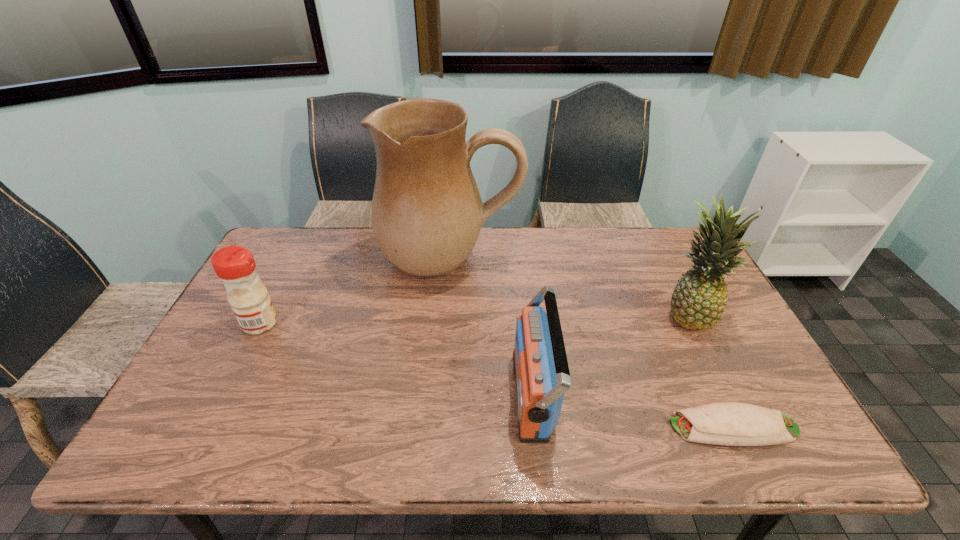
The width and height of the screenshot is (960, 540). I want to click on free space between the pineapple and the tallest object, so click(570, 287).

Identify the location of vacant area that lies between the radio receiver and the leftmost object. Image resolution: width=960 pixels, height=540 pixels. (396, 359).

This screenshot has width=960, height=540. I want to click on free space between the farthest object and the burrito, so click(592, 343).

Where is `free space between the leftmost object and the farthest object`? free space between the leftmost object and the farthest object is located at coordinates (355, 291).

The image size is (960, 540). I want to click on vacant space that is in between the fourth shortest object and the cream pitcher, so point(570,287).

Image resolution: width=960 pixels, height=540 pixels. In order to click on vacant area that lies between the cream pitcher and the radio receiver in this screenshot , I will do `click(492, 327)`.

The height and width of the screenshot is (540, 960). I want to click on empty space that is in between the second tallest object and the burrito, so click(711, 371).

Identify which object is the nearest to the farthest object. Please provide its 2D coordinates. Your answer should be formatted as a tuple, i.e. [(x, y)], where the tuple contains the x and y coordinates of a point satisfying the conditions above.

[(541, 370)]

Locate which object is the closest to the burrito. Please provide its 2D coordinates. Your answer should be formatted as a tuple, i.e. [(x, y)], where the tuple contains the x and y coordinates of a point satisfying the conditions above.

[(698, 301)]

This screenshot has height=540, width=960. I want to click on free space that satisfies the following two spatial constraints: 1. on the front side of the pineapple; 2. on the front-facing side of the radio receiver, so click(729, 394).